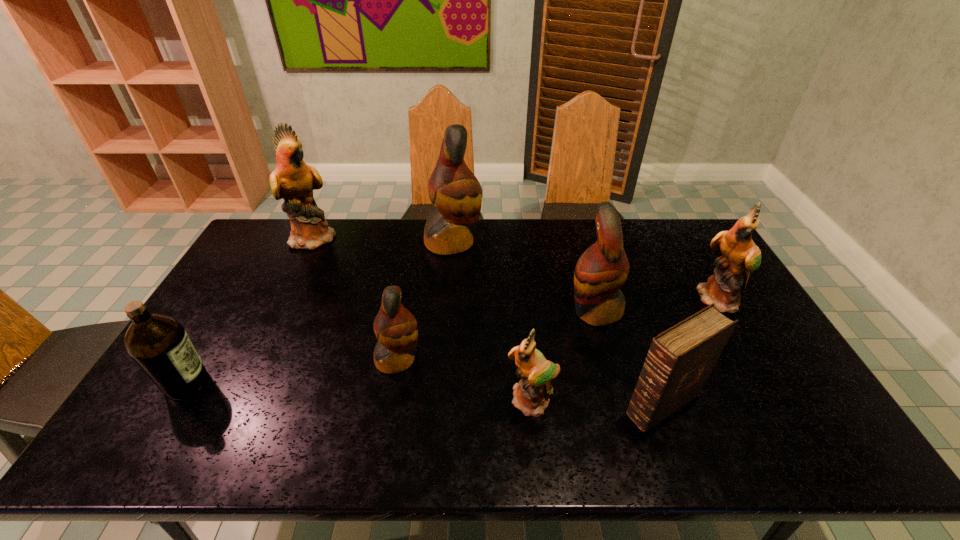
The height and width of the screenshot is (540, 960). In order to click on the smallest red parrot in this screenshot , I will do `click(396, 329)`.

Where is `the second nearest parrot`? The image size is (960, 540). the second nearest parrot is located at coordinates (396, 329).

You are a GUI agent. You are given a task and a screenshot of the screen. Output one action in this format:
    pyautogui.click(x=<x>, y=<y>)
    Task: Click on the nearest parrot
    The image size is (960, 540).
    Given the screenshot: What is the action you would take?
    point(531,395)

The width and height of the screenshot is (960, 540). In order to click on the fourth object from right to left in this screenshot , I will do `click(531, 395)`.

The height and width of the screenshot is (540, 960). Identify the location of free space located on the front-facing side of the leftmost green parrot. (428, 237).

I want to click on vacant space located 0.350m on the face of the biggest red parrot, so click(578, 241).

You are a GUI agent. You are given a task and a screenshot of the screen. Output one action in this format:
    pyautogui.click(x=<x>, y=<y>)
    Task: Click on the free space located on the face of the second biggest red parrot
    This screenshot has height=540, width=960.
    Given the screenshot: What is the action you would take?
    pyautogui.click(x=548, y=310)

Identify the location of free spot located 0.270m on the face of the second biggest red parrot. (479, 310).

Image resolution: width=960 pixels, height=540 pixels. I want to click on free point located on the face of the second biggest red parrot, so click(453, 310).

Where is `free spot located on the front-facing side of the rightmost parrot`? This screenshot has height=540, width=960. free spot located on the front-facing side of the rightmost parrot is located at coordinates (754, 355).